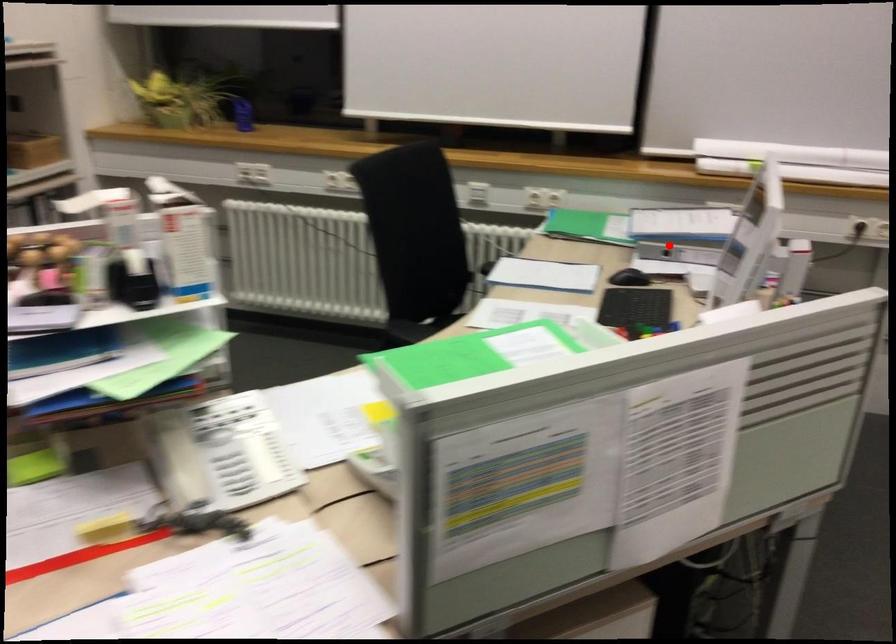
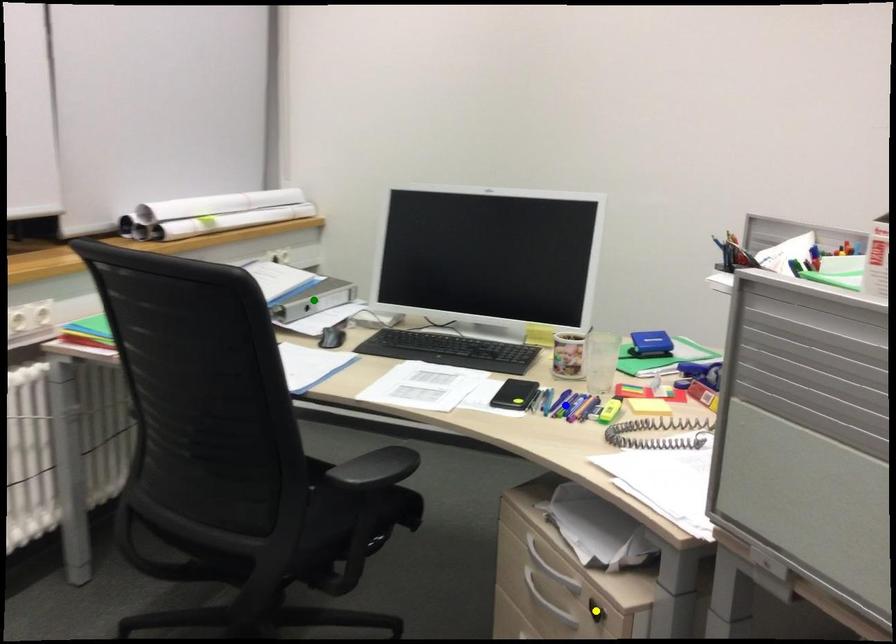
Question: I am providing you with two images of the same scene from different viewpoints. A red point is marked on the first image. You are given multiple points on the second image. Which point in image 2 is actually the same real-world point as the red point in image 1?

Choices:
 (A) blue point
 (B) green point
 (C) yellow point

Answer: (B)